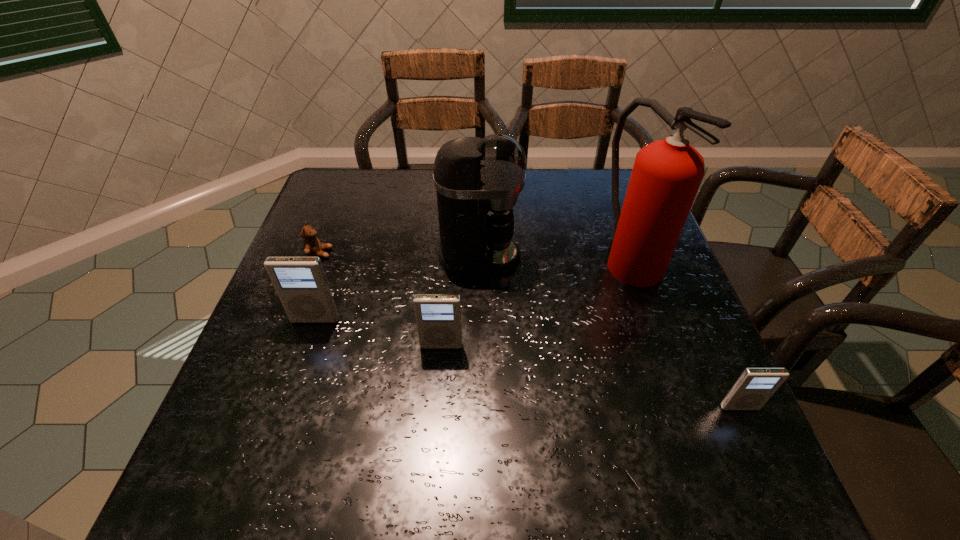
At what (x,y) coordinates should I click in order to perform the action: click on vacant space at the far edge of the desktop. Please return your answer as a coordinate pair (x, y). This screenshot has height=540, width=960. Looking at the image, I should click on (396, 206).

Identify the location of vacant space at the near edge of the desktop. This screenshot has height=540, width=960. (422, 417).

In the image, there is a desktop. Where is `vacant space at the right edge`? The height and width of the screenshot is (540, 960). vacant space at the right edge is located at coordinates (606, 241).

In the image, there is a desktop. Identify the location of vacant space at the far left corner. 354,194.

Where is `vacant space that's between the shortest object and the nearest iPod`? The height and width of the screenshot is (540, 960). vacant space that's between the shortest object and the nearest iPod is located at coordinates (530, 330).

The image size is (960, 540). Find the location of `vacant space that's between the second tallest object and the tallest object`. vacant space that's between the second tallest object and the tallest object is located at coordinates (555, 257).

Locate an element on the screen. empty space between the third shortest object and the nearest iPod is located at coordinates (590, 376).

You are a GUI agent. You are given a task and a screenshot of the screen. Output one action in this format:
    pyautogui.click(x=<x>, y=<y>)
    Task: Click on the unoccupied area between the second tallest object and the fire extinguisher
    The image size is (960, 540).
    Given the screenshot: What is the action you would take?
    pyautogui.click(x=555, y=257)

Locate an element on the screen. unoccupied area between the shortest iPod and the fire extinguisher is located at coordinates (684, 332).

Where is `empty space between the nearest object and the farthest iPod`? empty space between the nearest object and the farthest iPod is located at coordinates (527, 363).